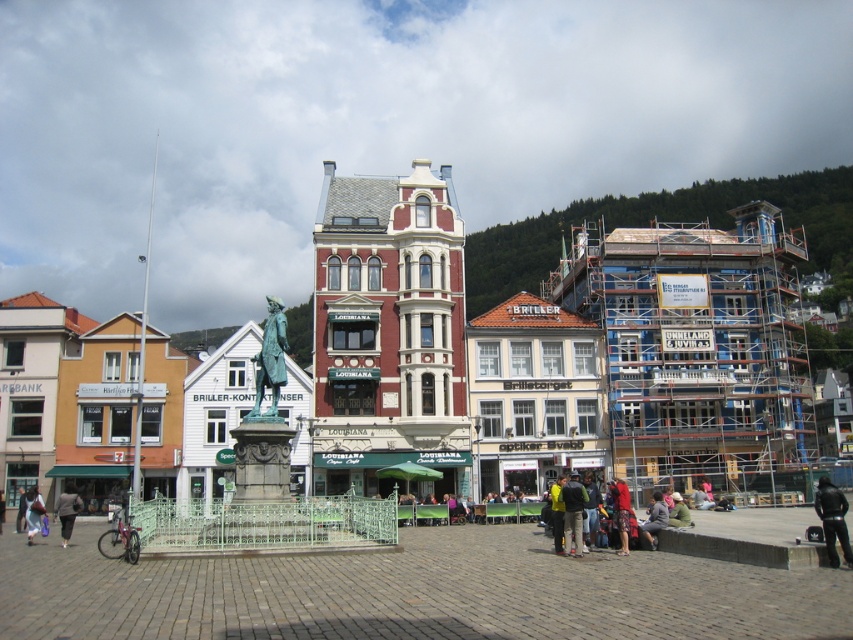
Who is more forward, (367, 248) or (33, 504)?

Positioned in front is point (33, 504).

Does red brick building at center have a lesser height compared to light brown leather jacket at lower left?

In fact, red brick building at center may be taller than light brown leather jacket at lower left.

Between point (337, 236) and point (28, 531), which one is positioned in front?

Point (28, 531) is in front.

The height and width of the screenshot is (640, 853). I want to click on red brick building at center, so click(387, 332).

At what (x,y) coordinates should I click in order to perform the action: click on black leather jacket at lower right. Please return your answer as a coordinate pair (x, y). This screenshot has width=853, height=640. Looking at the image, I should click on (833, 518).

Can you confirm if black leather jacket at lower right is shorter than dark gray fabric jacket at lower left?

No, black leather jacket at lower right is not shorter than dark gray fabric jacket at lower left.

Locate an element on the screen. black leather jacket at lower right is located at coordinates (833, 518).

Between dark gray fabric jacket at lower left and light brown leather jacket at lower left, which one is positioned higher?

dark gray fabric jacket at lower left is above.

Which is in front, point (73, 509) or point (35, 502)?

Point (73, 509)

Which is behind, point (73, 516) or point (35, 512)?

The point (35, 512) is behind.

At what (x,y) coordinates should I click in order to perform the action: click on dark gray fabric jacket at lower left. Please return your answer as a coordinate pair (x, y). Looking at the image, I should click on (67, 512).